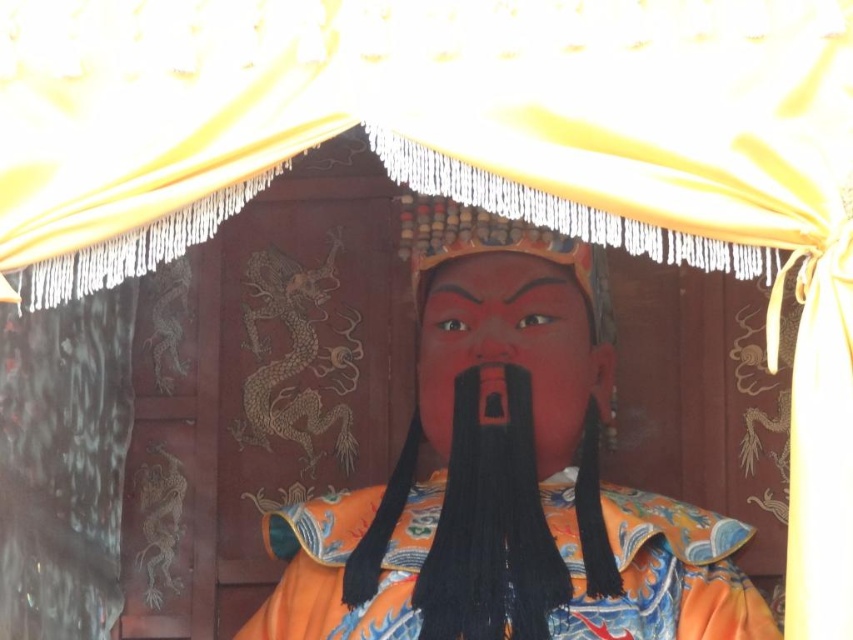
Does matte orange robe at center have a greater height compared to matte red nose at center?

Indeed, matte orange robe at center has a greater height compared to matte red nose at center.

This screenshot has height=640, width=853. Describe the element at coordinates (508, 486) in the screenshot. I see `matte orange robe at center` at that location.

You are a GUI agent. You are given a task and a screenshot of the screen. Output one action in this format:
    pyautogui.click(x=<x>, y=<y>)
    Task: Click on the matte orange robe at center
    Image resolution: width=853 pixels, height=640 pixels.
    Given the screenshot: What is the action you would take?
    pyautogui.click(x=508, y=486)

Is orange satin robe at center further to camera compared to matte black beard at center?

That is False.

Can you confirm if orange satin robe at center is wider than matte black beard at center?

Indeed, orange satin robe at center has a greater width compared to matte black beard at center.

The width and height of the screenshot is (853, 640). I want to click on orange satin robe at center, so click(656, 570).

Can you confirm if matte orange robe at center is bigger than matte black beard at center?

Indeed, matte orange robe at center has a larger size compared to matte black beard at center.

Is point (358, 552) positioned after point (534, 268)?

No.

Where is `matte orange robe at center`? matte orange robe at center is located at coordinates (508, 486).